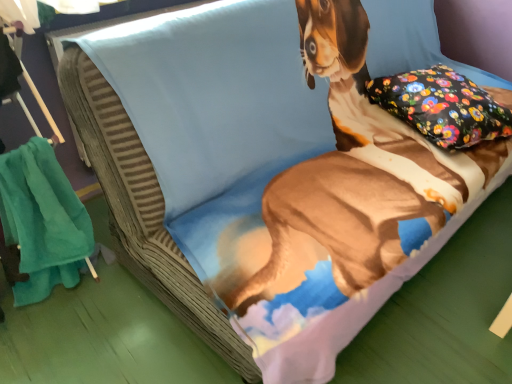
Question: Is floral fabric pillow at upper right in front of or behind teal soft towel at left in the image?

Choices:
 (A) front
 (B) behind

Answer: (B)

Question: Considering the positions of floral fabric pillow at upper right and teal soft towel at left in the image, is floral fabric pillow at upper right bigger or smaller than teal soft towel at left?

Choices:
 (A) big
 (B) small

Answer: (A)

Question: Is floral fabric pillow at upper right inside the boundaries of teal soft towel at left, or outside?

Choices:
 (A) outside
 (B) inside

Answer: (A)

Question: Does point (38, 144) appear closer or farther from the camera than point (452, 94)?

Choices:
 (A) closer
 (B) farther

Answer: (A)

Question: From the image's perspective, is teal soft towel at left located above or below floral fabric pillow at upper right?

Choices:
 (A) above
 (B) below

Answer: (B)

Question: Would you say teal soft towel at left is to the left or to the right of floral fabric pillow at upper right in the picture?

Choices:
 (A) left
 (B) right

Answer: (A)

Question: Is teal soft towel at left wider or thinner than floral fabric pillow at upper right?

Choices:
 (A) wide
 (B) thin

Answer: (B)